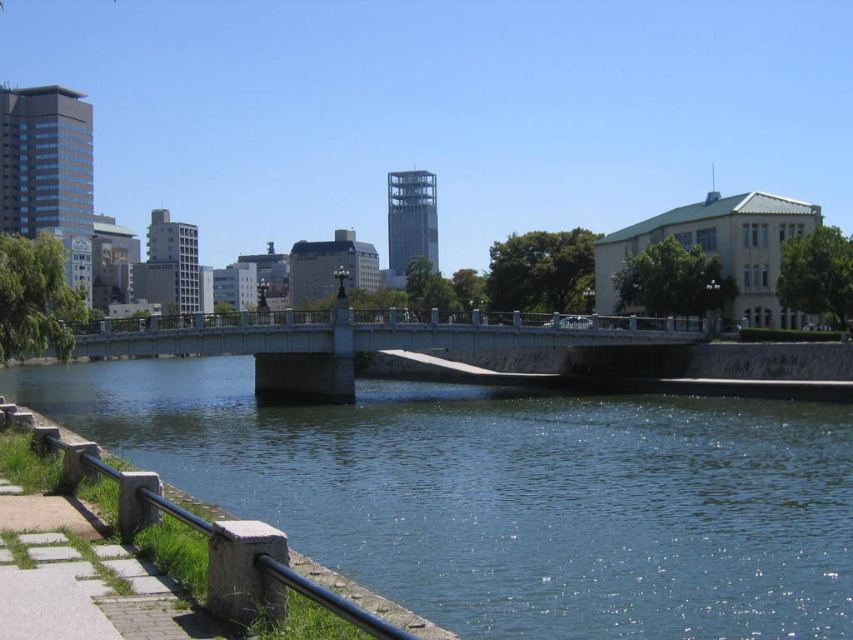
You are a maintenance worker needing to replace a part that requires reaching 3 meters high. You have a ladder that can extend up to 2.5 meters. Looking at the smooth concrete bridge at center and the stone textured rail at lower left in the scene, which object can you safely reach with your ladder?

The ladder can reach up to 2.5 meters. The smooth concrete bridge at center is taller than the stone textured rail at lower left. Since the bridge is taller, the ladder cannot reach it, but the rail is shorter and within the ladder height limit. Therefore, you can safely reach the stone textured rail at lower left with your ladder.

You are standing at the point marked as point (508,496) in the image. Based on the scene description, what do you see directly below you?

The point (508,496) corresponds to clear blue water at center, so you are directly above the clear blue water at center.

You are a painter setting up an easel to capture the riverside scene. You want to ensure your canvas can accommodate both the clear blue water at center and the stone textured rail at lower left. Given that the canvas is 1 meter wide, which object should you prioritize placing on the left side to fit both?

The clear blue water at center is wider than the stone textured rail at lower left. To fit both on a 1 meter canvas, prioritize placing the narrower stone textured rail at lower left on the left side, allowing the wider clear blue water at center to occupy more space on the right.